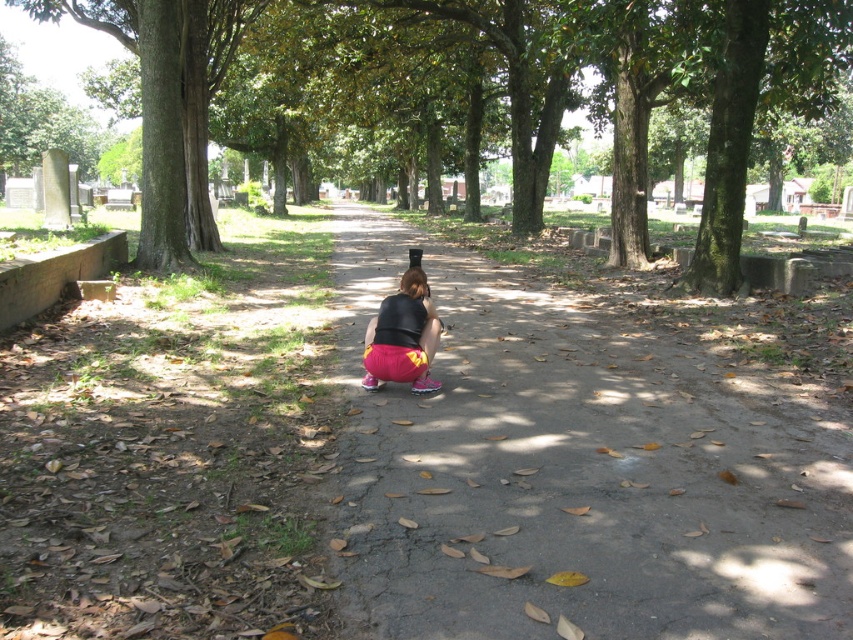
Who is positioned more to the left, green rough bark tree at center or pink matte shorts at center?

pink matte shorts at center is more to the left.

Is point (549, 40) in front of point (422, 365)?

No.

Describe the element at coordinates (526, 90) in the screenshot. This screenshot has height=640, width=853. I see `green rough bark tree at center` at that location.

Image resolution: width=853 pixels, height=640 pixels. I want to click on green rough bark tree at center, so click(x=526, y=90).

Is dirt path at center shorter than green rough bark tree at center?

Yes.

Is point (541, 508) positioned behind point (627, 205)?

No, (541, 508) is closer to viewer.

You are a GUI agent. You are given a task and a screenshot of the screen. Output one action in this format:
    pyautogui.click(x=<x>, y=<y>)
    Task: Click on the dirt path at center
    The height and width of the screenshot is (640, 853).
    Given the screenshot: What is the action you would take?
    pyautogui.click(x=577, y=470)

Who is more distant from viewer, (670, 547) or (376, 376)?

Positioned behind is point (376, 376).

Does dirt path at center have a larger size compared to pink matte shorts at center?

Indeed, dirt path at center has a larger size compared to pink matte shorts at center.

Locate an element on the screen. dirt path at center is located at coordinates (577, 470).

Where is `dirt path at center`? dirt path at center is located at coordinates pyautogui.click(x=577, y=470).